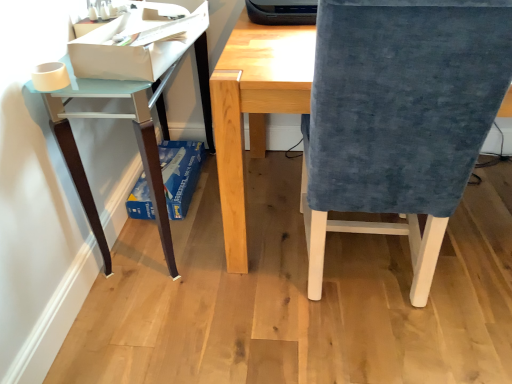
I want to click on vacant area that is in front of blue cardboard box at lower left, the 1th paperback book from the bottom, so click(181, 238).